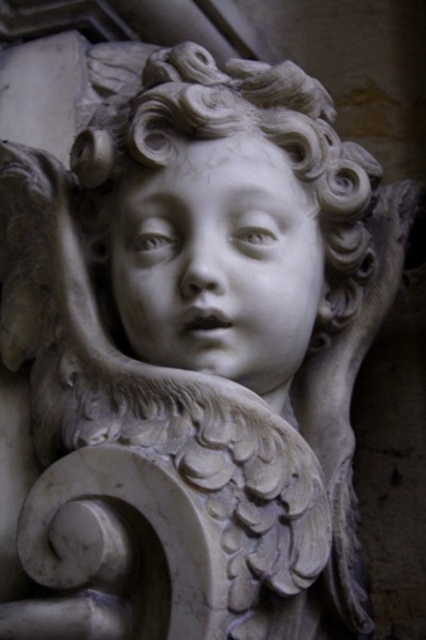
Who is higher up, white marble head at center or white marble face at center?

white marble head at center is above.

Which is in front, point (328, 248) or point (233, 308)?

Point (233, 308) is more forward.

Is point (299, 250) in front of point (204, 145)?

No.

Find the location of a particular element. white marble head at center is located at coordinates (230, 216).